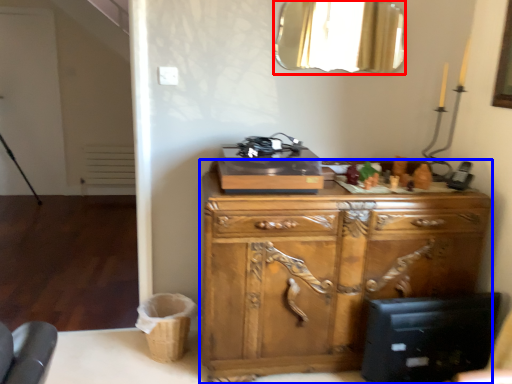
Question: Which object is further to the camera taking this photo, mirror (highlighted by a red box) or chest of drawers (highlighted by a blue box)?

Choices:
 (A) mirror
 (B) chest of drawers

Answer: (A)